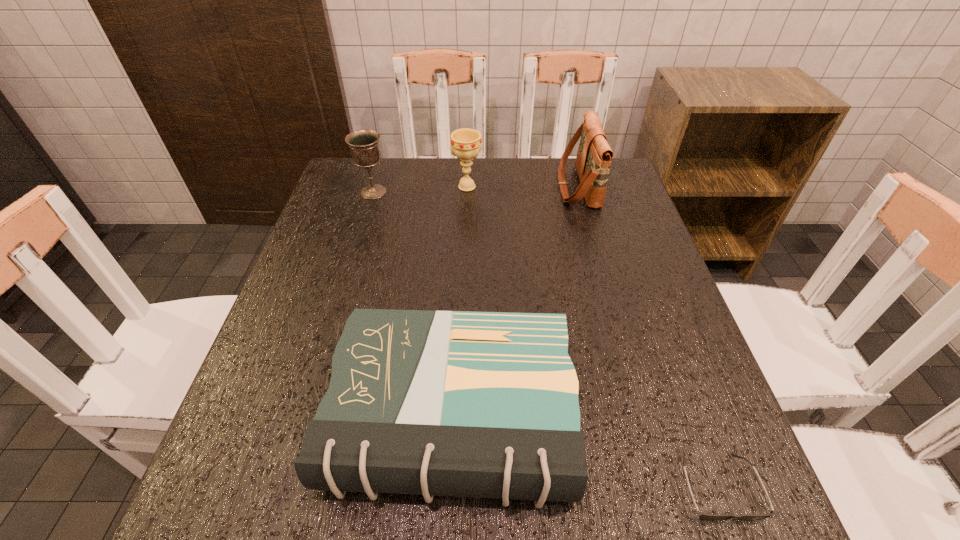
You are a GUI agent. You are given a task and a screenshot of the screen. Output one action in this format:
    pyautogui.click(x=<x>, y=<y>)
    Task: Click on the free space located on the right of the fourth tallest object
    
    Given the screenshot: What is the action you would take?
    pyautogui.click(x=639, y=417)

Find the location of a particular element. This screenshot has height=540, width=960. shoulder bag that is at the far edge is located at coordinates (593, 161).

You are a GUI agent. You are given a task and a screenshot of the screen. Output one action in this format:
    pyautogui.click(x=<x>, y=<y>)
    Task: Click on the paperback book that is at the near edge
    
    Given the screenshot: What is the action you would take?
    pyautogui.click(x=436, y=403)

This screenshot has height=540, width=960. I want to click on sunglasses located at the near edge, so click(710, 517).

In order to click on object present at the left edge in this screenshot , I will do `click(364, 144)`.

Identify the location of shoulder bag that is at the right edge. (593, 161).

The height and width of the screenshot is (540, 960). Find the location of `sunglasses situated at the right edge`. sunglasses situated at the right edge is located at coordinates (710, 517).

The image size is (960, 540). In order to click on object present at the far left corner in this screenshot , I will do `click(364, 144)`.

You are a GUI agent. You are given a task and a screenshot of the screen. Output one action in this format:
    pyautogui.click(x=<x>, y=<y>)
    Task: Click on the object that is at the far right corner
    This screenshot has height=540, width=960.
    Given the screenshot: What is the action you would take?
    pyautogui.click(x=593, y=161)

The image size is (960, 540). Find the location of `object present at the near right corner`. object present at the near right corner is located at coordinates (710, 517).